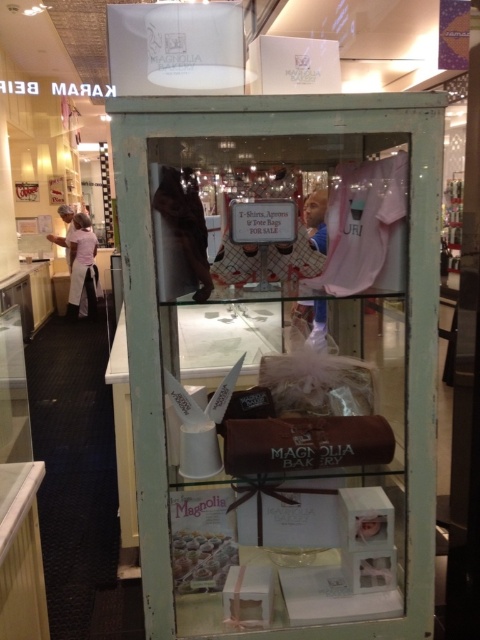
Is matte pink fabric at center thinner than white apron at left?

In fact, matte pink fabric at center might be wider than white apron at left.

Who is positioned more to the right, matte pink fabric at center or white apron at left?

From the viewer's perspective, matte pink fabric at center appears more on the right side.

Between point (255, 131) and point (72, 275), which one is positioned behind?

Positioned behind is point (72, 275).

The width and height of the screenshot is (480, 640). I want to click on matte pink fabric at center, so click(276, 380).

Who is positioned more to the left, white glossy cake at lower center or white apron at left?

From the viewer's perspective, white apron at left appears more on the left side.

Who is more forward, (x=222, y=540) or (x=95, y=308)?

Positioned in front is point (x=222, y=540).

Does point (204, 563) come closer to viewer compared to point (79, 246)?

Yes, it is in front of point (79, 246).

Identify the location of white glossy cake at lower center. (202, 561).

Who is positioned more to the right, matte pink fabric at center or white glossy cake at lower center?

From the viewer's perspective, matte pink fabric at center appears more on the right side.

Image resolution: width=480 pixels, height=640 pixels. Find the location of `matte pink fabric at center`. matte pink fabric at center is located at coordinates tap(276, 380).

This screenshot has height=640, width=480. Find the location of `matte pink fabric at center`. matte pink fabric at center is located at coordinates pyautogui.click(x=276, y=380).